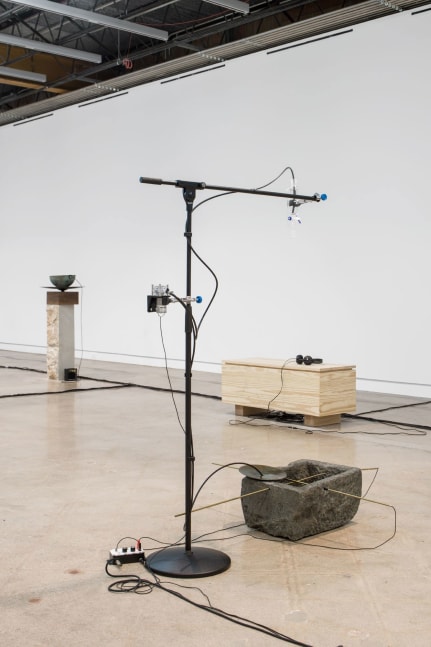
I want to click on wall, so [352, 308].